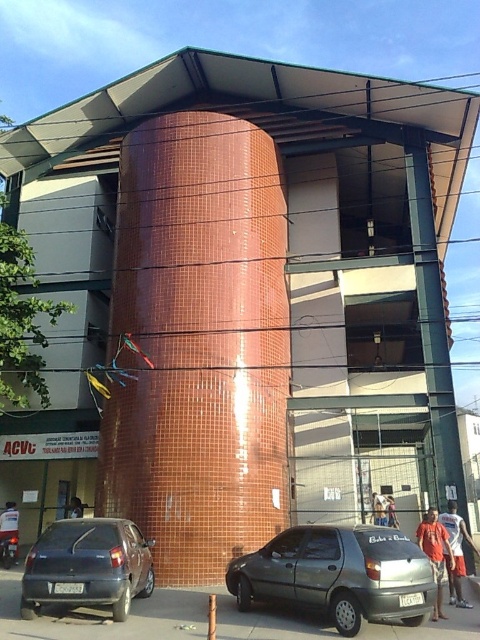
Question: Which object is closer to the camera taking this photo?

Choices:
 (A) matte gray car at lower left
 (B) metallic gray hatchback at lower center
 (C) gray asphalt pavement at lower center

Answer: (B)

Question: Is metallic gray hatchback at lower center to the left of gray asphalt pavement at lower center from the viewer's perspective?

Choices:
 (A) yes
 (B) no

Answer: (B)

Question: Does metallic gray hatchback at lower center have a smaller size compared to matte gray car at lower left?

Choices:
 (A) yes
 (B) no

Answer: (B)

Question: Estimate the real-world distances between objects in this image. Which object is farther from the metallic gray hatchback at lower center?

Choices:
 (A) matte gray car at lower left
 (B) gray asphalt pavement at lower center

Answer: (B)

Question: Can you confirm if metallic gray hatchback at lower center is positioned to the right of gray asphalt pavement at lower center?

Choices:
 (A) yes
 (B) no

Answer: (A)

Question: Which of these objects is positioned closest to the gray asphalt pavement at lower center?

Choices:
 (A) matte gray car at lower left
 (B) metallic gray hatchback at lower center

Answer: (A)